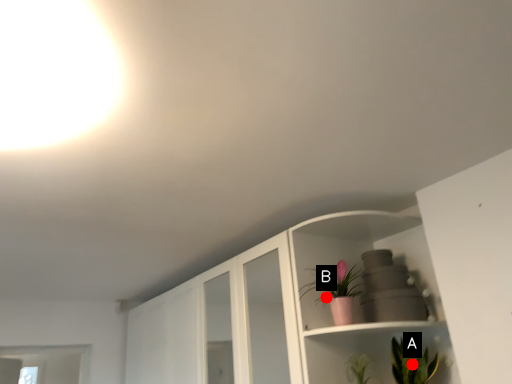
Question: Two points are circled on the image, labeled by A and B beside each circle. Which point is closer to the camera taking this photo?

Choices:
 (A) A is closer
 (B) B is closer

Answer: (A)